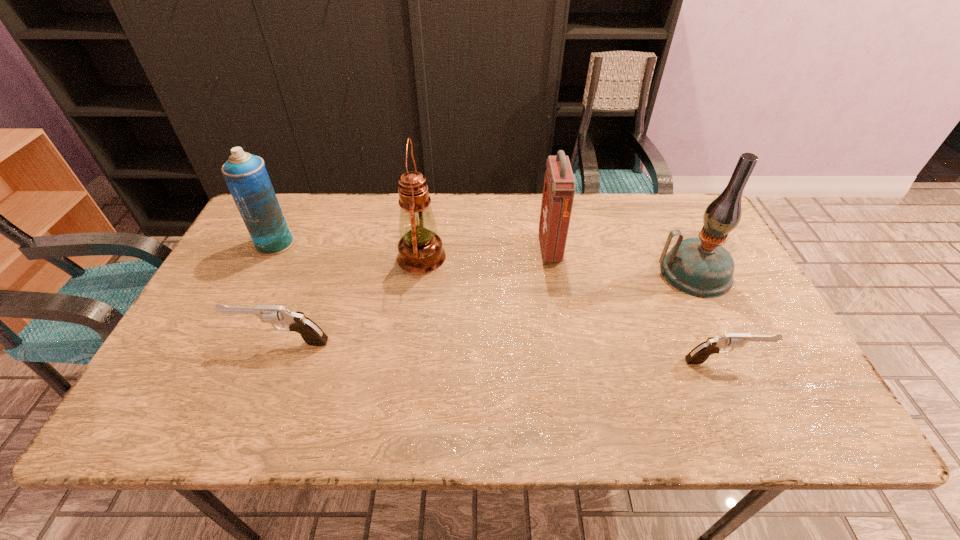
Where is `vacant space situated on the left of the third object from left to right`? vacant space situated on the left of the third object from left to right is located at coordinates (311, 256).

Locate an element on the screen. The height and width of the screenshot is (540, 960). vacant space positioned 0.070m on the left of the right oil lamp is located at coordinates (632, 273).

Find the location of a particular element. free space located 0.330m on the front of the aerosol can is located at coordinates (222, 349).

The image size is (960, 540). What are the coordinates of `blank area located on the front-facing side of the third object from right to left` in the screenshot? It's located at (503, 249).

The height and width of the screenshot is (540, 960). I want to click on vacant position located 0.290m on the front-facing side of the third object from right to left, so click(443, 249).

Locate an element on the screen. This screenshot has height=540, width=960. free region located on the front-facing side of the third object from right to left is located at coordinates (467, 249).

Where is `oil lamp situated at the far edge`? This screenshot has height=540, width=960. oil lamp situated at the far edge is located at coordinates (420, 250).

Locate an element on the screen. This screenshot has width=960, height=540. aerosol can located in the far edge section of the desktop is located at coordinates (245, 174).

At what (x,y) coordinates should I click in order to perform the action: click on the first-aid kit positioned at the far edge. Please return your answer as a coordinate pair (x, y). This screenshot has height=540, width=960. Looking at the image, I should click on (559, 184).

At what (x,y) coordinates should I click in order to perform the action: click on object positioned at the near edge. Please return your answer as a coordinate pair (x, y). Looking at the image, I should click on (698, 355).